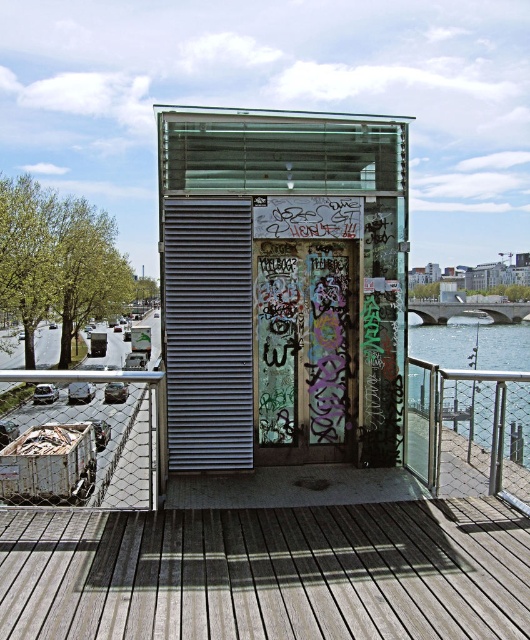
You are a delivery person carrying a large package that is 2 meters wide. You need to pass through the area near the metallic glass bus stop at center and the clear water at lower right. Can your package fit through the space between them?

The metallic glass bus stop at center is smaller than clear water at lower right. However, the description does not provide specific measurements of the space between them, so it is unclear if the 2 meter wide package can fit. Further information is needed to determine this.

You are standing on the wooden deck and want to reach the metallic glass bus stop at center. Which direction should you move relative to the wooden planks at center?

You should move to the right of the wooden planks at center to reach the metallic glass bus stop at center since it is located to the right of them.